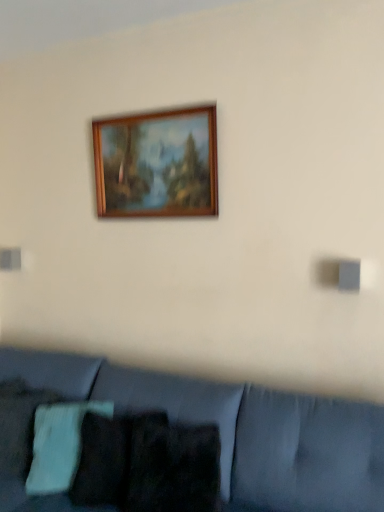
Question: From the image's perspective, does velvet blue couch at lower center appear higher than green knitted pillow at lower left?

Choices:
 (A) yes
 (B) no

Answer: (B)

Question: Considering the relative positions of velvet blue couch at lower center and green knitted pillow at lower left in the image provided, is velvet blue couch at lower center to the left of green knitted pillow at lower left from the viewer's perspective?

Choices:
 (A) no
 (B) yes

Answer: (A)

Question: From a real-world perspective, is velvet blue couch at lower center below green knitted pillow at lower left?

Choices:
 (A) no
 (B) yes

Answer: (B)

Question: Would you say velvet blue couch at lower center is a long distance from green knitted pillow at lower left?

Choices:
 (A) yes
 (B) no

Answer: (B)

Question: From the image's perspective, is velvet blue couch at lower center under green knitted pillow at lower left?

Choices:
 (A) no
 (B) yes

Answer: (B)

Question: Considering the relative sizes of velvet blue couch at lower center and green knitted pillow at lower left in the image provided, is velvet blue couch at lower center thinner than green knitted pillow at lower left?

Choices:
 (A) yes
 (B) no

Answer: (B)

Question: Could you tell me if green knitted pillow at lower left is facing wooden frame at upper center?

Choices:
 (A) no
 (B) yes

Answer: (A)

Question: From the image's perspective, is green knitted pillow at lower left on wooden frame at upper center?

Choices:
 (A) yes
 (B) no

Answer: (B)

Question: From a real-world perspective, is green knitted pillow at lower left located beneath wooden frame at upper center?

Choices:
 (A) no
 (B) yes

Answer: (B)

Question: Is green knitted pillow at lower left far from wooden frame at upper center?

Choices:
 (A) yes
 (B) no

Answer: (A)

Question: Can you confirm if green knitted pillow at lower left is positioned to the left of wooden frame at upper center?

Choices:
 (A) yes
 (B) no

Answer: (A)

Question: Can you confirm if green knitted pillow at lower left is wider than wooden frame at upper center?

Choices:
 (A) yes
 (B) no

Answer: (A)

Question: Is the position of green knitted pillow at lower left less distant than that of velvet blue couch at lower center?

Choices:
 (A) no
 (B) yes

Answer: (A)